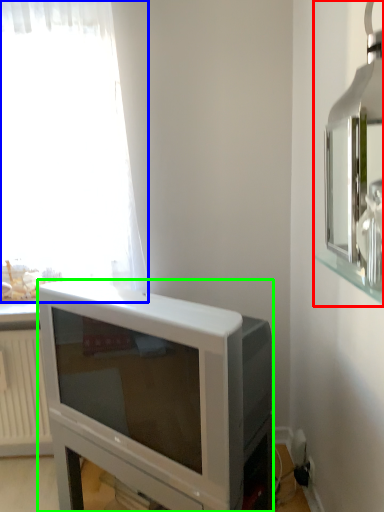
Question: Which is farther away from medicine cabinet (highlighted by a red box)? curtain (highlighted by a blue box) or television (highlighted by a green box)?

Choices:
 (A) curtain
 (B) television

Answer: (A)